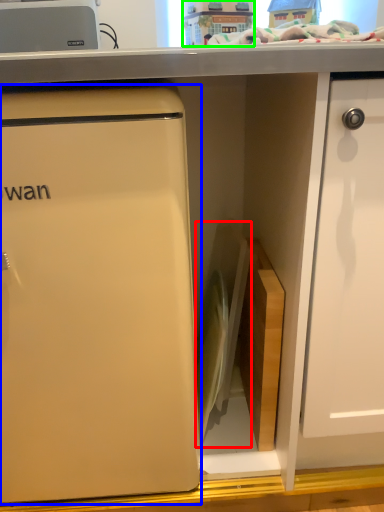
Question: Which is nearer to the appliance (highlighted by a red box)? refrigerator (highlighted by a blue box) or toy (highlighted by a green box).

Choices:
 (A) refrigerator
 (B) toy

Answer: (A)